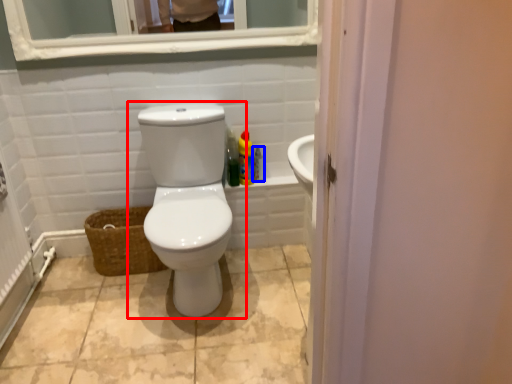
Question: Which object is further to the camera taking this photo, toilet (highlighted by a red box) or cleaning product (highlighted by a blue box)?

Choices:
 (A) toilet
 (B) cleaning product

Answer: (B)